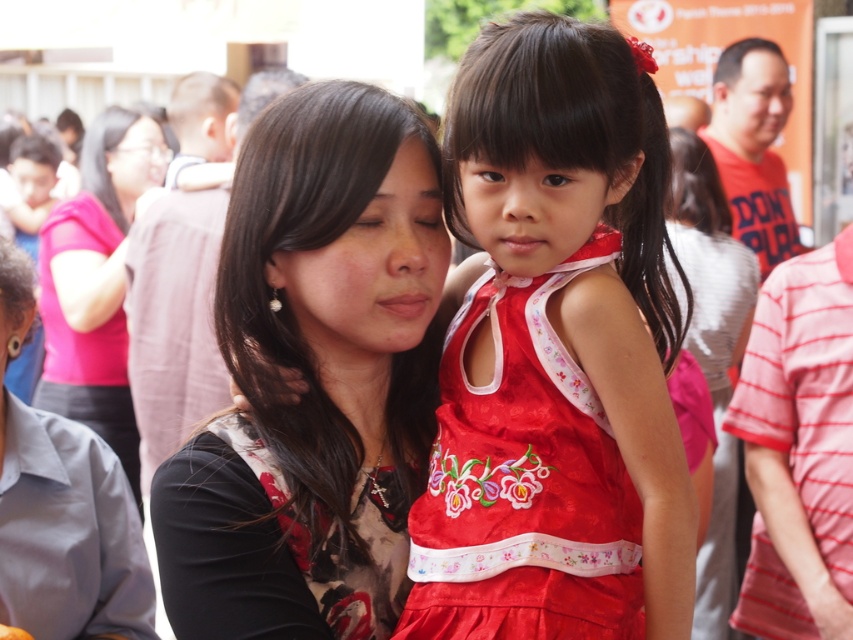
You are a photographer trying to capture a candid shot of the two subjects in the image. The silky red dress at center and the matte black shirt at center are both in your frame. If you want to ensure both are fully visible without cropping either, which one requires more space horizontally in your camera frame?

The matte black shirt at center requires more horizontal space in the camera frame because it has a greater width than the silky red dress at center.

You are a photographer at the event and need to capture a group photo of the black floral dress at center and the matte black shirt at center. The camera you have can focus on subjects within a 3 meter range. Can you ensure both subjects are in focus at the same time?

The distance between the black floral dress at center and the matte black shirt at center is 2.90 meters, which is within the camera focus range of 3 meters. Therefore, both subjects can be in focus simultaneously.